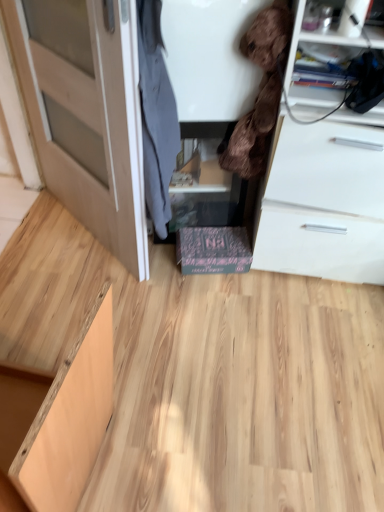
This screenshot has width=384, height=512. Find the location of `free space in front of black cardboard box at center, the first cabinetry from the back`. free space in front of black cardboard box at center, the first cabinetry from the back is located at coordinates (216, 301).